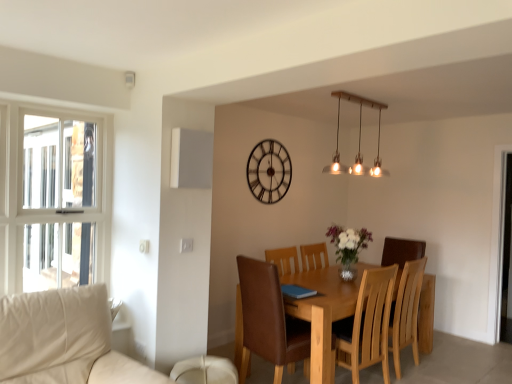
Question: Does metallic clock at upper center come behind light brown wooden table at center?

Choices:
 (A) yes
 (B) no

Answer: (A)

Question: Is metallic clock at upper center with light brown wooden table at center?

Choices:
 (A) no
 (B) yes

Answer: (A)

Question: Is metallic clock at upper center oriented away from light brown wooden table at center?

Choices:
 (A) yes
 (B) no

Answer: (B)

Question: Is metallic clock at upper center wider than light brown wooden table at center?

Choices:
 (A) yes
 (B) no

Answer: (B)

Question: Considering the relative sizes of metallic clock at upper center and light brown wooden table at center in the image provided, is metallic clock at upper center shorter than light brown wooden table at center?

Choices:
 (A) yes
 (B) no

Answer: (A)

Question: Considering the positions of translucent glass vase at center and matte brass pendant lights at upper center in the image, is translucent glass vase at center taller or shorter than matte brass pendant lights at upper center?

Choices:
 (A) short
 (B) tall

Answer: (A)

Question: Is point (361, 228) closer or farther from the camera than point (354, 97)?

Choices:
 (A) closer
 (B) farther

Answer: (B)

Question: From a real-world perspective, relative to matte brass pendant lights at upper center, is translucent glass vase at center vertically above or below?

Choices:
 (A) above
 (B) below

Answer: (B)

Question: From the image's perspective, is translucent glass vase at center above or below matte brass pendant lights at upper center?

Choices:
 (A) above
 (B) below

Answer: (B)

Question: Choose the correct answer: Is translucent glass vase at center inside light brown wooden table at center or outside it?

Choices:
 (A) outside
 (B) inside

Answer: (A)

Question: From the image's perspective, is translucent glass vase at center located above or below light brown wooden table at center?

Choices:
 (A) below
 (B) above

Answer: (B)

Question: From a real-world perspective, is translucent glass vase at center positioned above or below light brown wooden table at center?

Choices:
 (A) below
 (B) above

Answer: (B)

Question: Is point (366, 238) positioned closer to the camera than point (354, 292)?

Choices:
 (A) farther
 (B) closer

Answer: (A)

Question: From the image's perspective, relative to matte brass pendant lights at upper center, is metallic clock at upper center above or below?

Choices:
 (A) above
 (B) below

Answer: (B)

Question: From their relative heights in the image, would you say metallic clock at upper center is taller or shorter than matte brass pendant lights at upper center?

Choices:
 (A) tall
 (B) short

Answer: (A)